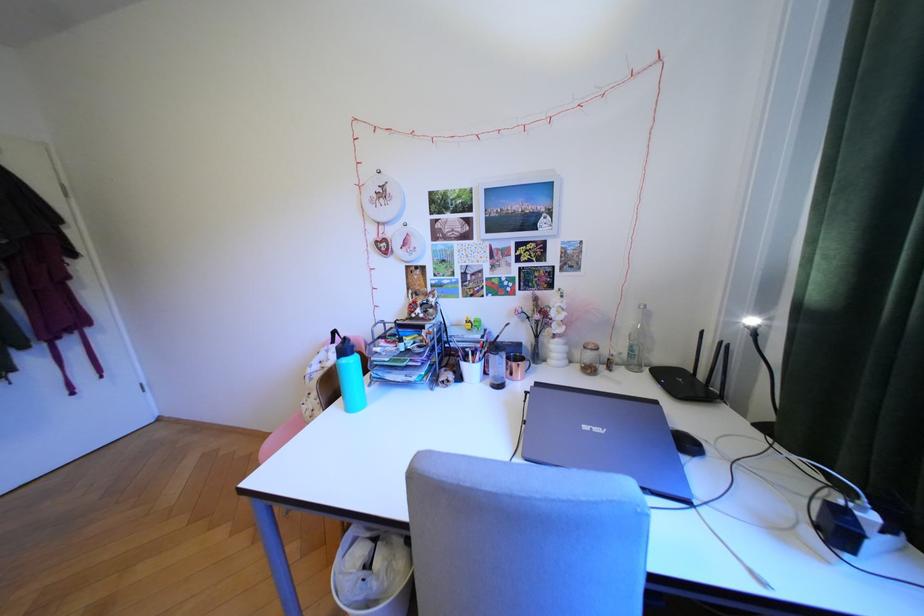
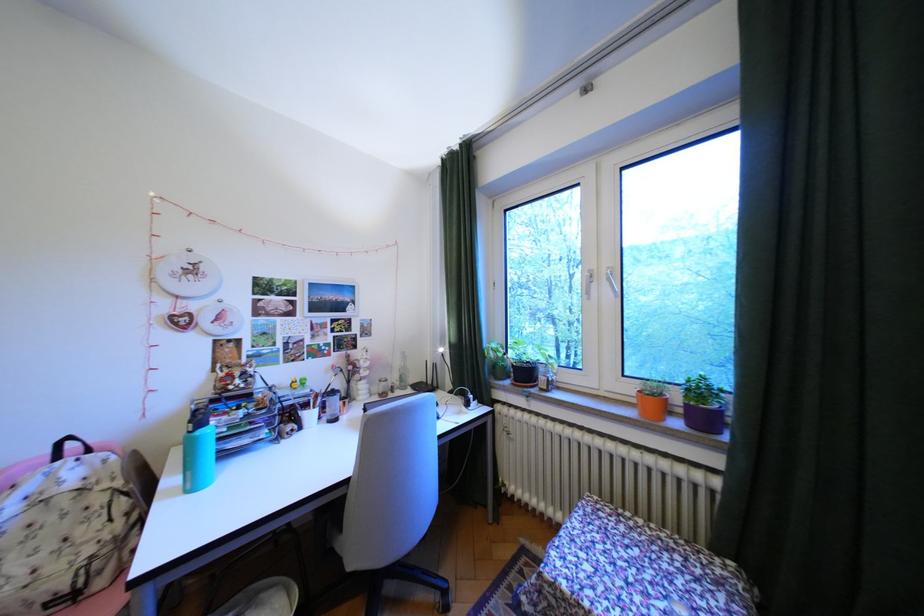
Where in the second image is the point corresponding to point 629,347 from the first image?

(407, 379)